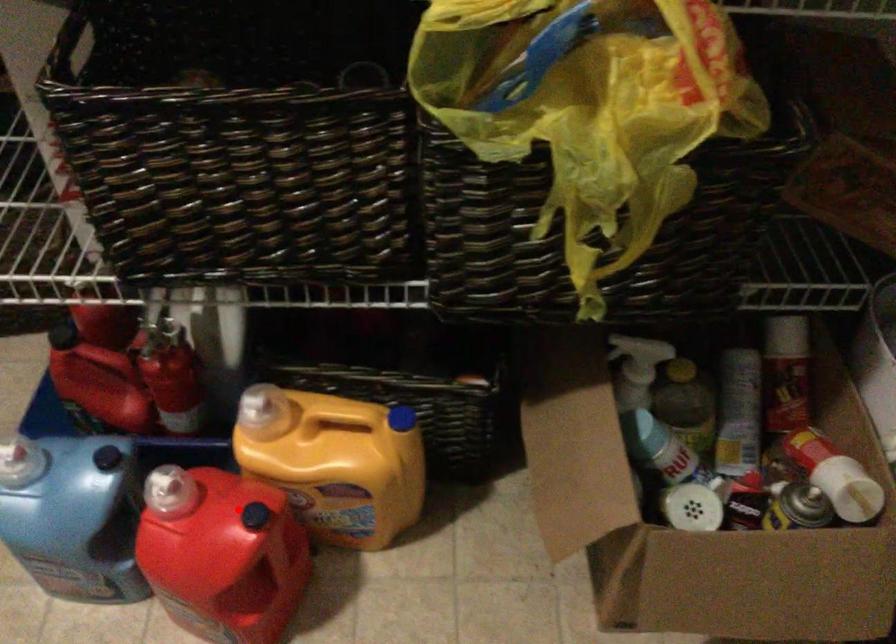
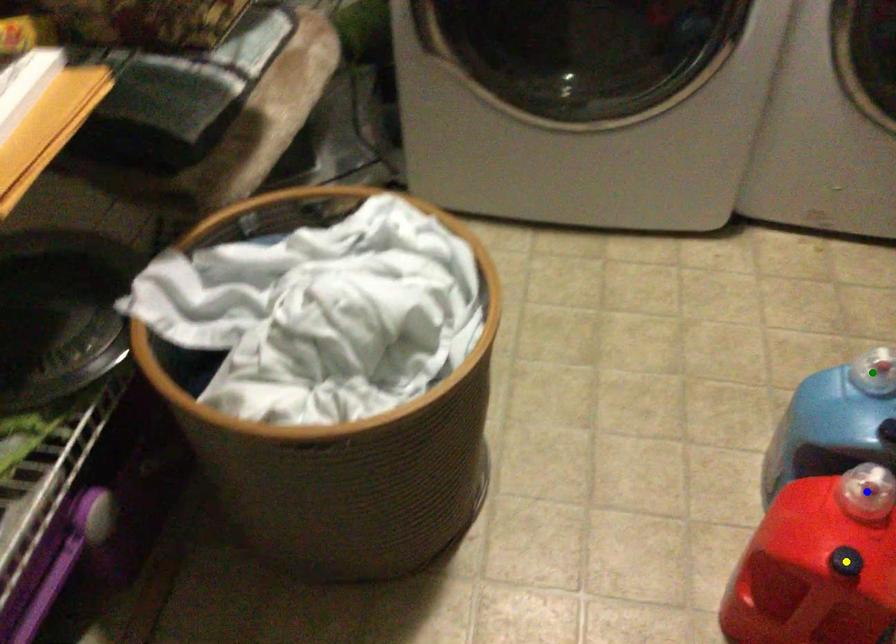
Question: I am providing you with two images of the same scene from different viewpoints. A red point is marked on the first image. You are given multiple points on the second image. Can you choose the point in image 2 that corresponds to the point in image 1?

Choices:
 (A) blue point
 (B) green point
 (C) yellow point

Answer: (C)